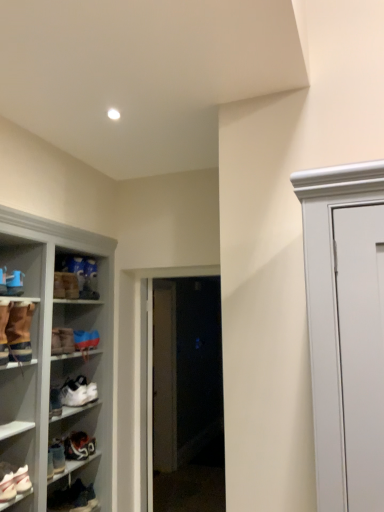
Question: Is matte brown boot at upper left, the seventh footwear in the bottom-to-top sequence, at the right side of brown suede boot at left, placed as the 3th footwear when sorted from top to bottom?

Choices:
 (A) yes
 (B) no

Answer: (A)

Question: Considering the relative sizes of matte brown boot at upper left, which is counted as the second footwear, starting from the top, and brown suede boot at left, placed as the 3th footwear when sorted from top to bottom, in the image provided, is matte brown boot at upper left, which is counted as the second footwear, starting from the top, thinner than brown suede boot at left, placed as the 3th footwear when sorted from top to bottom,?

Choices:
 (A) no
 (B) yes

Answer: (B)

Question: Does matte brown boot at upper left, which is counted as the second footwear, starting from the top, have a smaller size compared to brown suede boot at left, placed as the 3th footwear when sorted from top to bottom?

Choices:
 (A) yes
 (B) no

Answer: (A)

Question: From a real-world perspective, is matte brown boot at upper left, the seventh footwear in the bottom-to-top sequence, below brown suede boot at left, the sixth footwear positioned from the bottom?

Choices:
 (A) yes
 (B) no

Answer: (B)

Question: Is brown suede boot at left, placed as the 3th footwear when sorted from top to bottom, at the back of matte brown boot at upper left, the seventh footwear in the bottom-to-top sequence?

Choices:
 (A) no
 (B) yes

Answer: (A)

Question: Relative to white matte sneaker at lower left, which is the fifth footwear from top to bottom, is blue suede sneakers at lower left, the fifth footwear when ordered from bottom to top, in front or behind?

Choices:
 (A) front
 (B) behind

Answer: (B)

Question: Is blue suede sneakers at lower left, the fifth footwear when ordered from bottom to top, wider or thinner than white matte sneaker at lower left, marked as the fourth footwear in a bottom-to-top arrangement?

Choices:
 (A) thin
 (B) wide

Answer: (A)

Question: Based on their sizes in the image, would you say blue suede sneakers at lower left, placed as the 4th footwear when sorted from top to bottom, is bigger or smaller than white matte sneaker at lower left, marked as the fourth footwear in a bottom-to-top arrangement?

Choices:
 (A) big
 (B) small

Answer: (B)

Question: Visually, is blue suede sneakers at lower left, placed as the 4th footwear when sorted from top to bottom, positioned to the left or to the right of white matte sneaker at lower left, marked as the fourth footwear in a bottom-to-top arrangement?

Choices:
 (A) left
 (B) right

Answer: (B)

Question: From a real-world perspective, is white leather sneakers at lower left, arranged as the third footwear when ordered from the bottom, positioned above or below dark brown leather shoe at lower left, acting as the eighth footwear starting from the top?

Choices:
 (A) above
 (B) below

Answer: (A)

Question: Looking at the image, does white leather sneakers at lower left, arranged as the third footwear when ordered from the bottom, seem bigger or smaller compared to dark brown leather shoe at lower left, which is the 1th footwear in bottom-to-top order?

Choices:
 (A) small
 (B) big

Answer: (B)

Question: Is white leather sneakers at lower left, arranged as the third footwear when ordered from the bottom, in front of or behind dark brown leather shoe at lower left, which is the 1th footwear in bottom-to-top order, in the image?

Choices:
 (A) front
 (B) behind

Answer: (A)

Question: Is white leather sneakers at lower left, arranged as the third footwear when ordered from the bottom, inside the boundaries of dark brown leather shoe at lower left, which is the 1th footwear in bottom-to-top order, or outside?

Choices:
 (A) outside
 (B) inside

Answer: (A)

Question: Is point (206, 291) closer or farther from the camera than point (91, 439)?

Choices:
 (A) closer
 (B) farther

Answer: (B)

Question: In the image, is transparent glass door at center positioned in front of or behind white leather sneaker at lower left, which is the seventh footwear in top-to-bottom order?

Choices:
 (A) behind
 (B) front

Answer: (A)